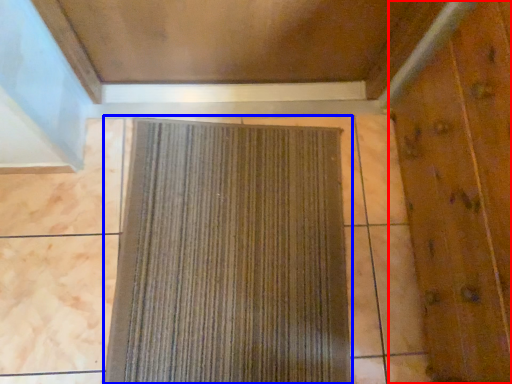
Question: Among these objects, which one is farthest to the camera, elevator door (highlighted by a red box) or curtain (highlighted by a blue box)?

Choices:
 (A) elevator door
 (B) curtain

Answer: (B)